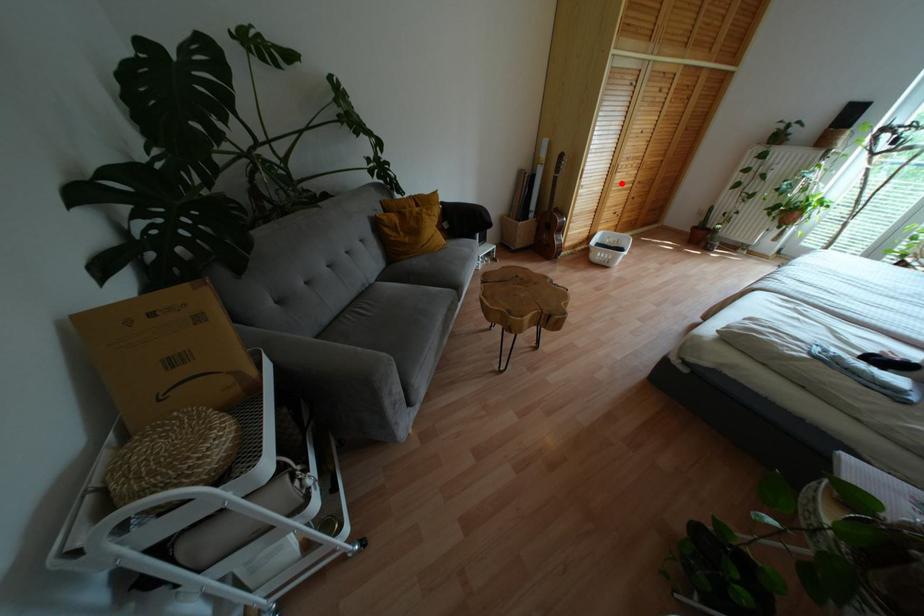
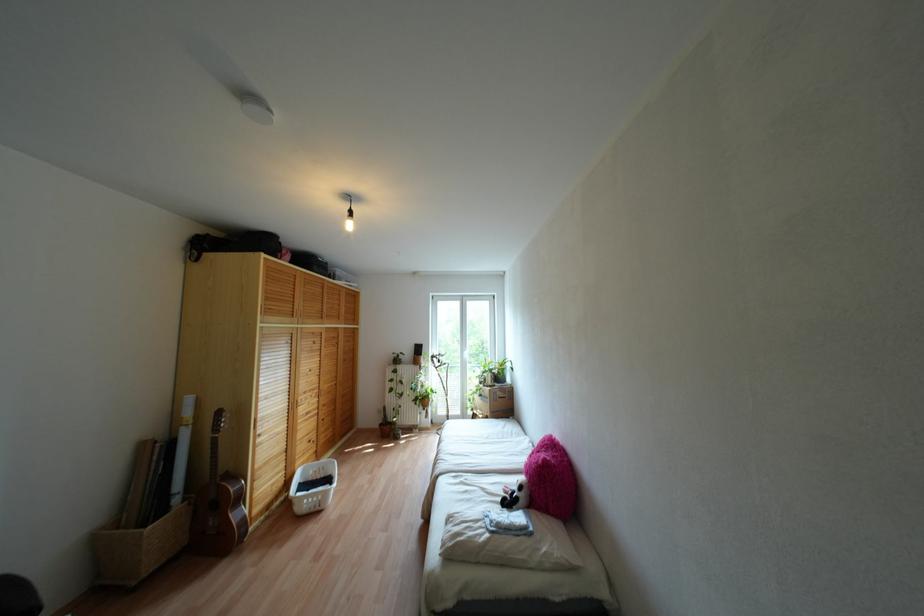
Question: I am providing you with two images of the same scene from different viewpoints. Image1 has a red point marked. In image2, the corresponding 3D location appears at what relative position? Reply with the corresponding letter.

Choices:
 (A) Closer
 (B) Farther

Answer: (B)